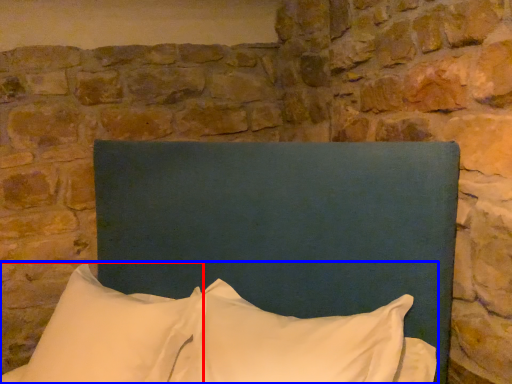
Question: Among these objects, which one is farthest to the camera, pillow (highlighted by a red box) or pillow (highlighted by a blue box)?

Choices:
 (A) pillow
 (B) pillow

Answer: (A)